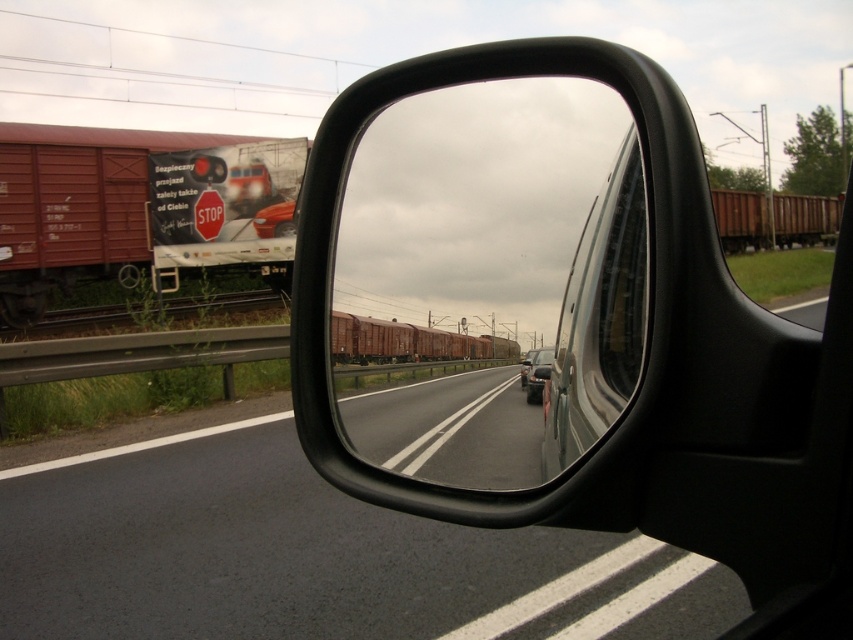
Who is more distant from viewer, (590,374) or (262,305)?

The point (262,305) is more distant.

From the picture: Is transparent glass car window at center bigger than brown metal train track at lower left?

Indeed, transparent glass car window at center has a larger size compared to brown metal train track at lower left.

Which is behind, point (590, 337) or point (202, 314)?

The point (202, 314) is behind.

I want to click on transparent glass car window at center, so click(x=599, y=317).

Which of these two, brown metal train track at lower left or rusty metal train at center, stands taller?

With more height is brown metal train track at lower left.

Image resolution: width=853 pixels, height=640 pixels. Find the location of `brown metal train track at lower left`. brown metal train track at lower left is located at coordinates (149, 314).

Is red corrugated metal train at left shorter than rusty metal train at center?

In fact, red corrugated metal train at left may be taller than rusty metal train at center.

Is red corrugated metal train at left positioned behind rusty metal train at center?

Yes, red corrugated metal train at left is behind rusty metal train at center.

Find the location of a particular element. Image resolution: width=853 pixels, height=640 pixels. red corrugated metal train at left is located at coordinates (74, 209).